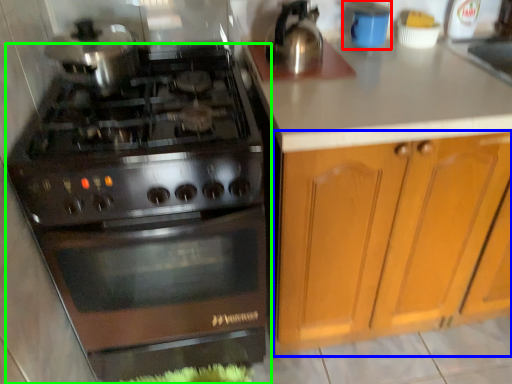
Question: Which object is positioned closest to appliance (highlighted by a red box)? Select from cabinetry (highlighted by a blue box) and gas stove (highlighted by a green box).

Choices:
 (A) cabinetry
 (B) gas stove

Answer: (A)